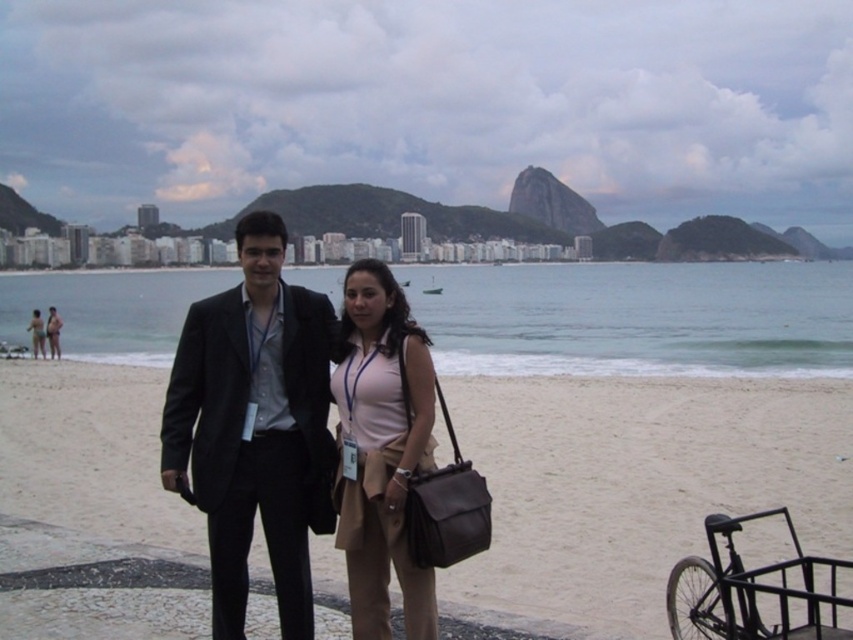
Question: Can you confirm if beige sand at center is positioned above matte black suit at center?

Choices:
 (A) yes
 (B) no

Answer: (B)

Question: Is black matte suit at center to the right of matte black suit at center from the viewer's perspective?

Choices:
 (A) no
 (B) yes

Answer: (B)

Question: Which object is the closest to the matte pink shirt at center?

Choices:
 (A) matte black suit at center
 (B) beige sand at center

Answer: (B)

Question: Does beige sand at center have a greater width compared to black matte suit at center?

Choices:
 (A) yes
 (B) no

Answer: (A)

Question: Which point appears closest to the camera in this image?

Choices:
 (A) (625, 444)
 (B) (215, 532)
 (C) (32, 339)

Answer: (B)

Question: Which of the following is the farthest from the observer?

Choices:
 (A) matte black suit at center
 (B) black matte suit at center
 (C) matte pink shirt at center

Answer: (A)